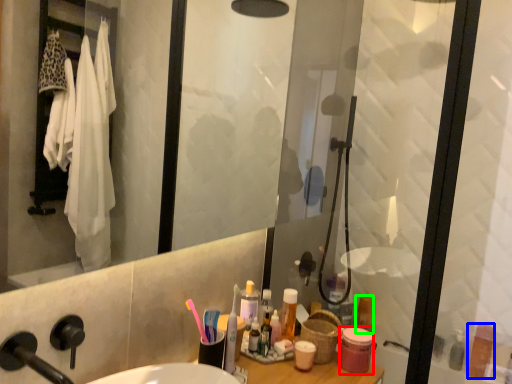
Question: Which object is the farthest from toiletry (highlighted by a red box)? Choose among these: toiletry (highlighted by a blue box) or toiletry (highlighted by a green box).

Choices:
 (A) toiletry
 (B) toiletry

Answer: (A)